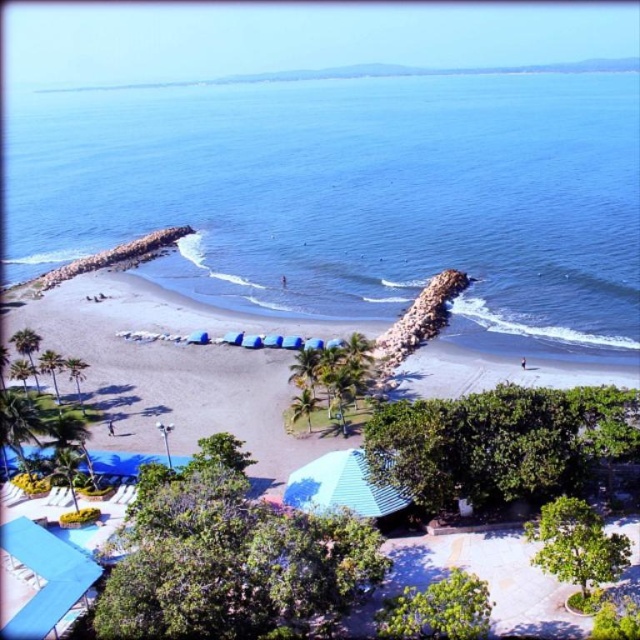
Looking at this image, who is taller, blue water at center or brown sandy beach at center?

blue water at center

Is blue water at center bigger than brown sandy beach at center?

Yes.

This screenshot has height=640, width=640. Identify the location of blue water at center. (355, 196).

Find the location of a particular element. blue water at center is located at coordinates (355, 196).